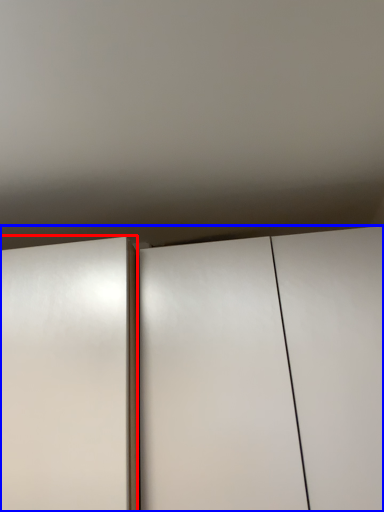
Question: Which object appears farthest to the camera in this image, door (highlighted by a red box) or cupboard (highlighted by a blue box)?

Choices:
 (A) door
 (B) cupboard

Answer: (B)